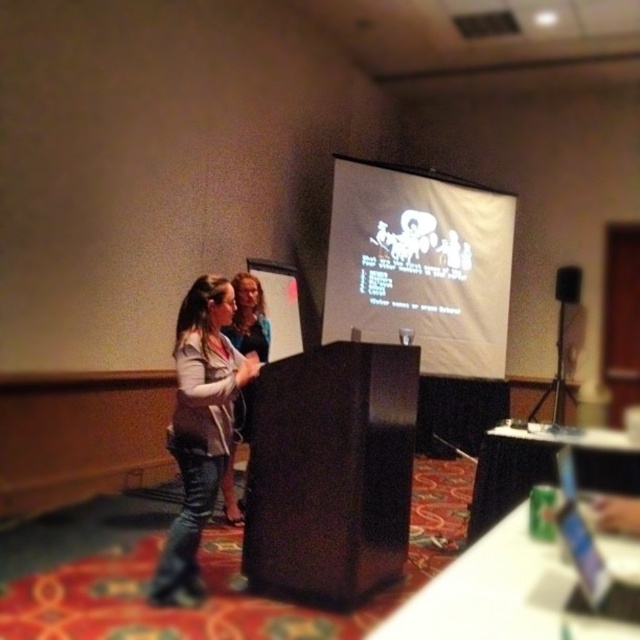
What do you see at coordinates (198, 428) in the screenshot?
I see `denim jacket at left` at bounding box center [198, 428].

Is point (204, 317) closer to camera compared to point (556, 275)?

Yes, point (204, 317) is in front of point (556, 275).

The image size is (640, 640). What do you see at coordinates (198, 428) in the screenshot? I see `denim jacket at left` at bounding box center [198, 428].

Find the location of `denim jacket at left`. denim jacket at left is located at coordinates (198, 428).

Who is lower down, white matte projection screen at center or black matte speaker at upper right?

Positioned lower is black matte speaker at upper right.

You are a GUI agent. You are given a task and a screenshot of the screen. Output one action in this format:
    pyautogui.click(x=<x>, y=<y>)
    Task: Click on the white matte projection screen at center
    Image resolution: width=640 pixels, height=640 pixels.
    Given the screenshot: What is the action you would take?
    pyautogui.click(x=419, y=266)

Who is positioned more to the right, white matte projection screen at center or denim jacket at left?

white matte projection screen at center

Which is below, white matte projection screen at center or denim jacket at left?

Positioned lower is denim jacket at left.

Where is `white matte projection screen at center`? Image resolution: width=640 pixels, height=640 pixels. white matte projection screen at center is located at coordinates (419, 266).